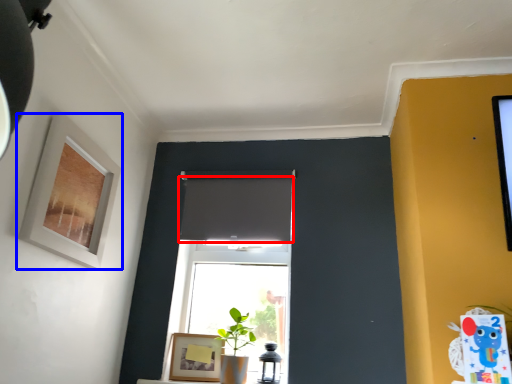
Question: Which point is further to the camera, curtain (highlighted by a red box) or picture frame (highlighted by a blue box)?

Choices:
 (A) curtain
 (B) picture frame

Answer: (A)